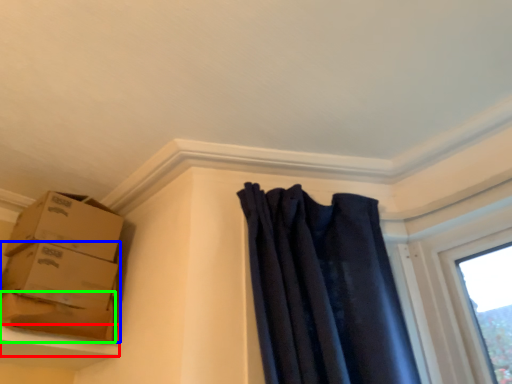
Question: Estimate the real-world distances between objects in this image. Which object is closer to window sill (highlighted by a red box), box (highlighted by a blue box) or cardboard box (highlighted by a green box)?

Choices:
 (A) box
 (B) cardboard box

Answer: (B)